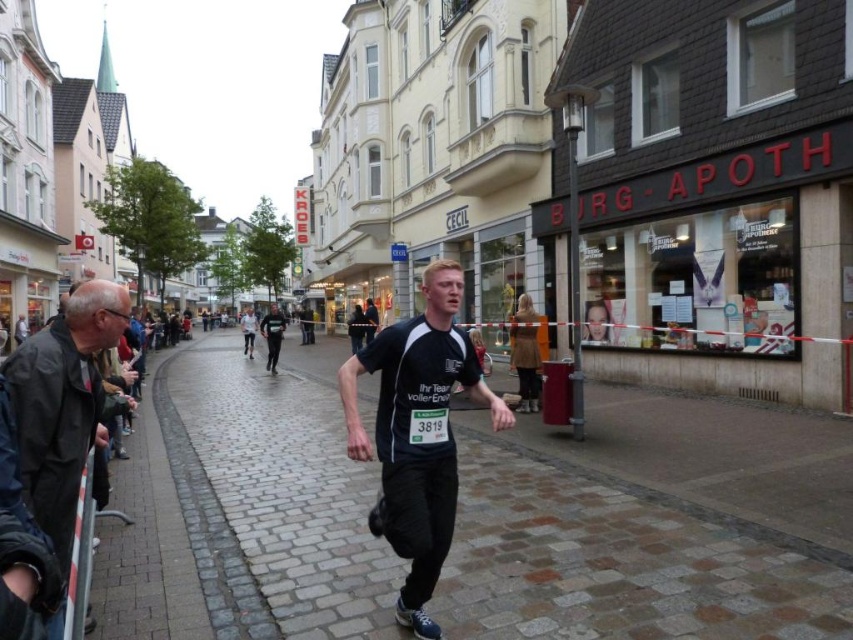
Does cobblestone pavement at center lie behind red plastic sign at center right?

No, cobblestone pavement at center is in front of red plastic sign at center right.

Does cobblestone pavement at center have a larger size compared to red plastic sign at center right?

Yes, cobblestone pavement at center is bigger than red plastic sign at center right.

Who is more distant from viewer, [699,483] or [817,144]?

The point [817,144] is more distant.

Where is `cobblestone pavement at center`? The image size is (853, 640). cobblestone pavement at center is located at coordinates (619, 557).

Is point (738, 173) positioned behind point (267, 324)?

No, (738, 173) is closer to viewer.

Does red plastic sign at center right have a greater height compared to dark gray fabric jacket at center?

Incorrect, red plastic sign at center right's height is not larger of dark gray fabric jacket at center's.

Which is behind, point (595, 216) or point (265, 364)?

Positioned behind is point (265, 364).

Find the location of a particular element. Image resolution: width=853 pixels, height=640 pixels. red plastic sign at center right is located at coordinates (723, 176).

Is black matte running shirt at center wider than black matte jacket at left?

No, black matte running shirt at center is not wider than black matte jacket at left.

Which is in front, point (450, 374) or point (39, 342)?

Positioned in front is point (39, 342).

Where is `black matte running shirt at center`? This screenshot has width=853, height=640. black matte running shirt at center is located at coordinates (416, 433).